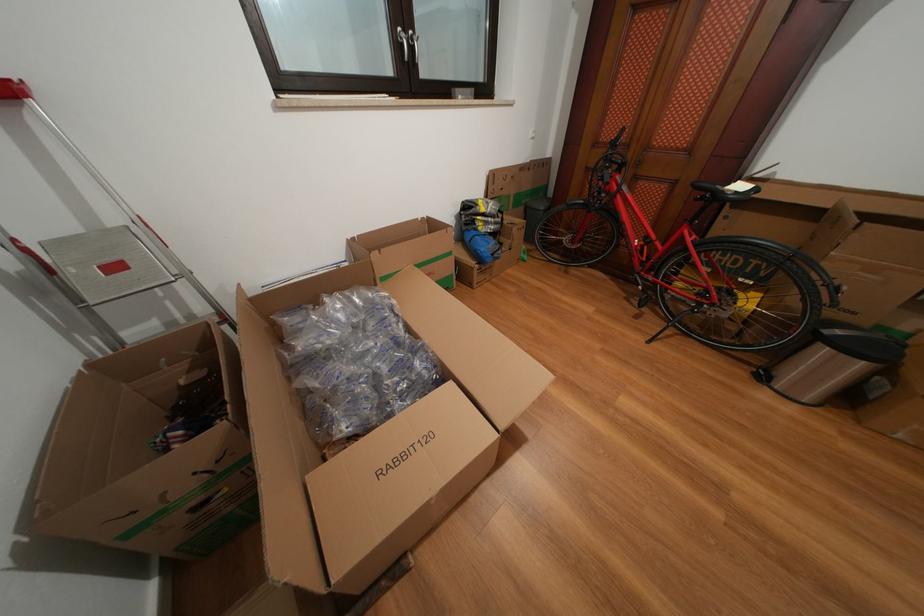
What do you see at coordinates (724, 191) in the screenshot? I see `a black bicycle seat` at bounding box center [724, 191].